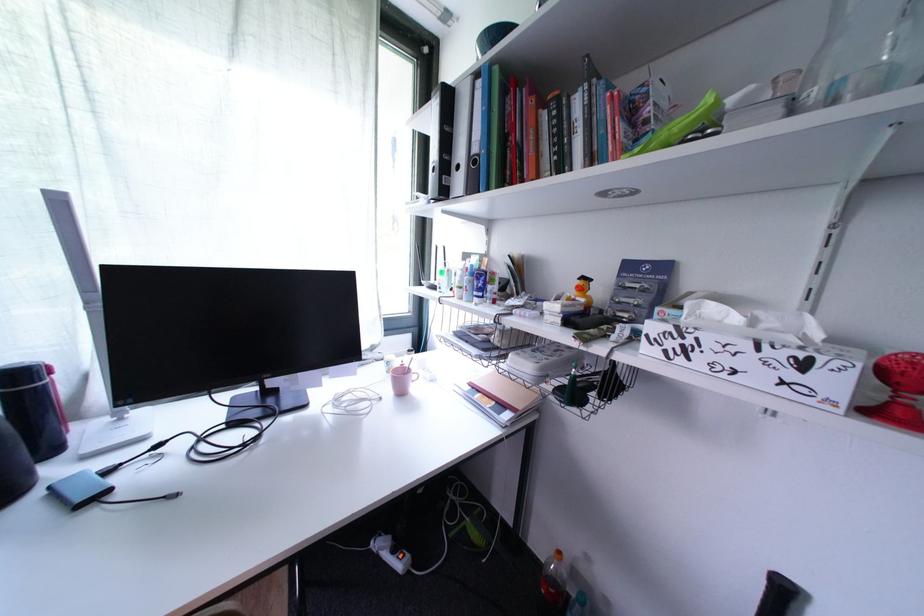
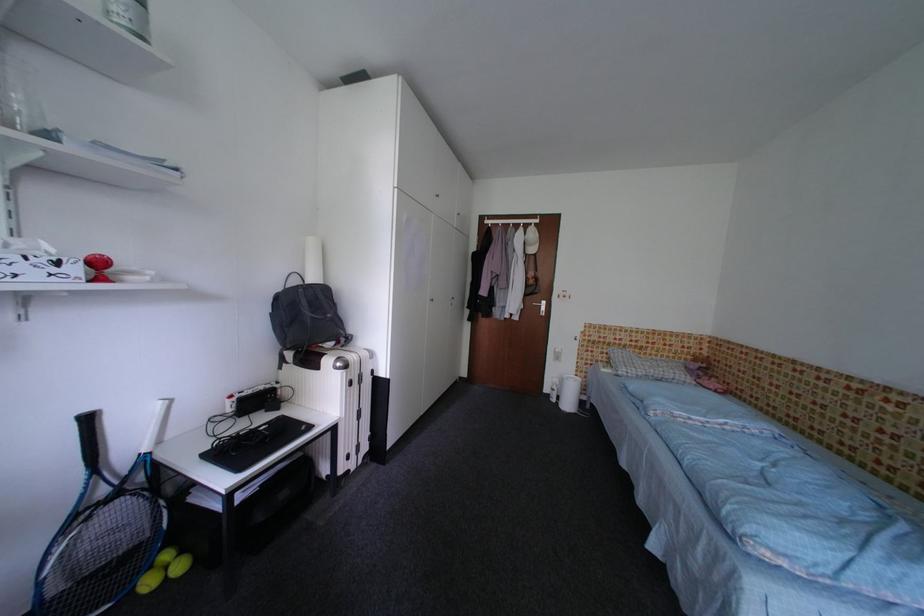
In the second image, find the point that corresponds to (x=843, y=386) in the first image.

(83, 272)